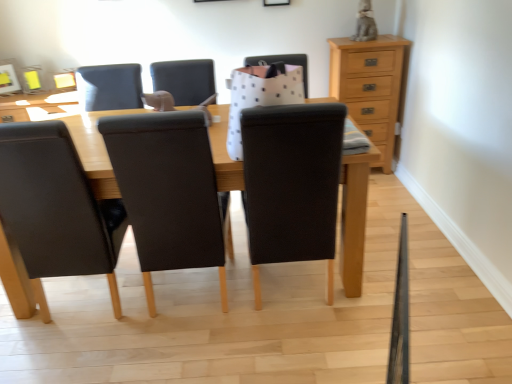
Measure the distance between point (200, 167) and camera.

Point (200, 167) is 1.71 meters away from camera.

Describe the element at coordinates (170, 193) in the screenshot. Image resolution: width=512 pixels, height=384 pixels. I see `leather at center, positioned as the 2th chair in right-to-left order` at that location.

Where is `black fabric chair at center, which ranks as the third chair in left-to-right order`? This screenshot has height=384, width=512. black fabric chair at center, which ranks as the third chair in left-to-right order is located at coordinates (291, 184).

From the picture: Can you see light brown wood chest of drawers at upper right touching leather at left, the 1th chair from the left?

No, light brown wood chest of drawers at upper right is not touching leather at left, the 1th chair from the left.

Could you tell me if light brown wood chest of drawers at upper right is facing leather at left, which is the 3th chair in right-to-left order?

No, light brown wood chest of drawers at upper right is not turned towards leather at left, which is the 3th chair in right-to-left order.

From a real-world perspective, is light brown wood chest of drawers at upper right under leather at left, the 1th chair from the left?

Yes, from a real-world perspective, light brown wood chest of drawers at upper right is below leather at left, the 1th chair from the left.

Considering the positions of objects light brown wood chest of drawers at upper right and leather at left, which is the 3th chair in right-to-left order, in the image provided, who is in front, light brown wood chest of drawers at upper right or leather at left, which is the 3th chair in right-to-left order,?

leather at left, which is the 3th chair in right-to-left order, is in front.

Does leather at center, positioned as the 2th chair in right-to-left order, have a greater height compared to leather at left, the 1th chair from the left?

No, leather at center, positioned as the 2th chair in right-to-left order, is not taller than leather at left, the 1th chair from the left.

In the scene shown: Is leather at center, which appears as the second chair when viewed from the left, at the right side of leather at left, which is the 3th chair in right-to-left order?

Yes.

From the image's perspective, is leather at center, positioned as the 2th chair in right-to-left order, beneath black fabric chair at center, which ranks as the third chair in left-to-right order?

Correct, leather at center, positioned as the 2th chair in right-to-left order, appears lower than black fabric chair at center, which ranks as the third chair in left-to-right order, in the image.

From the picture: Is leather at center, positioned as the 2th chair in right-to-left order, at the left side of black fabric chair at center, which ranks as the third chair in left-to-right order?

Yes.

Considering the relative sizes of leather at center, which appears as the second chair when viewed from the left, and black fabric chair at center, which ranks as the third chair in left-to-right order, in the image provided, is leather at center, which appears as the second chair when viewed from the left, thinner than black fabric chair at center, which ranks as the third chair in left-to-right order,?

Correct, the width of leather at center, which appears as the second chair when viewed from the left, is less than that of black fabric chair at center, which ranks as the third chair in left-to-right order.

Is point (267, 123) in front of point (191, 223)?

That is True.

From the image's perspective, is black fabric chair at center, positioned as the first chair in right-to-left order, beneath leather at center, positioned as the 2th chair in right-to-left order?

No, from the image's perspective, black fabric chair at center, positioned as the first chair in right-to-left order, is not beneath leather at center, positioned as the 2th chair in right-to-left order.

Is black fabric chair at center, positioned as the first chair in right-to-left order, placed right next to leather at center, positioned as the 2th chair in right-to-left order?

No, black fabric chair at center, positioned as the first chair in right-to-left order, is not beside leather at center, positioned as the 2th chair in right-to-left order.

Identify the location of chair located above the leather at center, positioned as the 2th chair in right-to-left order (from a real-world perspective). (291, 184).

The height and width of the screenshot is (384, 512). Find the location of `the chest of drawers that is above the leather at center, positioned as the 2th chair in right-to-left order (from the image's perspective)`. the chest of drawers that is above the leather at center, positioned as the 2th chair in right-to-left order (from the image's perspective) is located at coordinates (370, 87).

In terms of size, does light brown wood chest of drawers at upper right appear bigger or smaller than leather at center, positioned as the 2th chair in right-to-left order?

In the image, light brown wood chest of drawers at upper right appears to be smaller than leather at center, positioned as the 2th chair in right-to-left order.

How many degrees apart are the facing directions of light brown wood chest of drawers at upper right and leather at center, which appears as the second chair when viewed from the left?

The facing directions of light brown wood chest of drawers at upper right and leather at center, which appears as the second chair when viewed from the left, are 179 degrees apart.

Would you say light brown wood chest of drawers at upper right is to the left or to the right of leather at center, which appears as the second chair when viewed from the left, in the picture?

light brown wood chest of drawers at upper right is to the right of leather at center, which appears as the second chair when viewed from the left.

Is leather at center, which appears as the second chair when viewed from the left, shorter than light brown wood chest of drawers at upper right?

No.

Is leather at center, which appears as the second chair when viewed from the left, beside light brown wood chest of drawers at upper right?

No, leather at center, which appears as the second chair when viewed from the left, is not making contact with light brown wood chest of drawers at upper right.

In the image, is leather at center, which appears as the second chair when viewed from the left, on the left side or the right side of light brown wood chest of drawers at upper right?

Based on their positions, leather at center, which appears as the second chair when viewed from the left, is located to the left of light brown wood chest of drawers at upper right.

Is leather at left, which is the 3th chair in right-to-left order, oriented away from light brown wood chest of drawers at upper right?

That's not correct — leather at left, which is the 3th chair in right-to-left order, is not looking away from light brown wood chest of drawers at upper right.

Image resolution: width=512 pixels, height=384 pixels. What are the coordinates of `the chest of drawers located above the leather at left, which is the 3th chair in right-to-left order (from the image's perspective)` in the screenshot? It's located at (370, 87).

From the picture: From the image's perspective, which one is positioned lower, leather at left, the 1th chair from the left, or light brown wood chest of drawers at upper right?

leather at left, the 1th chair from the left, from the image's perspective.

In order to click on chest of drawers above the leather at left, which is the 3th chair in right-to-left order (from the image's perspective) in this screenshot , I will do `click(370, 87)`.

Where is `the 1st chair to the right of the leather at left, the 1th chair from the left, counting from the anchor's position`? the 1st chair to the right of the leather at left, the 1th chair from the left, counting from the anchor's position is located at coordinates (170, 193).

Based on their spatial positions, is leather at center, which appears as the second chair when viewed from the left, or light brown wood chest of drawers at upper right closer to black fabric chair at center, which ranks as the third chair in left-to-right order?

Among the two, leather at center, which appears as the second chair when viewed from the left, is located nearer to black fabric chair at center, which ranks as the third chair in left-to-right order.

Looking at the image, which one is located closer to leather at left, which is the 3th chair in right-to-left order, leather at center, which appears as the second chair when viewed from the left, or light brown wood chest of drawers at upper right?

Among the two, leather at center, which appears as the second chair when viewed from the left, is located nearer to leather at left, which is the 3th chair in right-to-left order.

From the image, which object appears to be nearer to leather at center, which appears as the second chair when viewed from the left, leather at left, which is the 3th chair in right-to-left order, or light brown wood chest of drawers at upper right?

leather at left, which is the 3th chair in right-to-left order, is closer to leather at center, which appears as the second chair when viewed from the left.

Looking at this image, estimate the real-world distances between objects in this image. Which object is closer to light brown wood chest of drawers at upper right, leather at center, positioned as the 2th chair in right-to-left order, or black fabric chair at center, positioned as the first chair in right-to-left order?

Based on the image, black fabric chair at center, positioned as the first chair in right-to-left order, appears to be nearer to light brown wood chest of drawers at upper right.

From the picture: From the image, which object appears to be farther from light brown wood chest of drawers at upper right, black fabric chair at center, which ranks as the third chair in left-to-right order, or leather at left, the 1th chair from the left?

leather at left, the 1th chair from the left, is positioned further to the anchor light brown wood chest of drawers at upper right.

Estimate the real-world distances between objects in this image. Which object is closer to leather at center, which appears as the second chair when viewed from the left, black fabric chair at center, positioned as the first chair in right-to-left order, or leather at left, the 1th chair from the left?

The object closer to leather at center, which appears as the second chair when viewed from the left, is leather at left, the 1th chair from the left.

Estimate the real-world distances between objects in this image. Which object is further from light brown wood chest of drawers at upper right, black fabric chair at center, positioned as the first chair in right-to-left order, or leather at center, positioned as the 2th chair in right-to-left order?

leather at center, positioned as the 2th chair in right-to-left order, lies further to light brown wood chest of drawers at upper right than the other object.

Based on their spatial positions, is leather at center, which appears as the second chair when viewed from the left, or black fabric chair at center, positioned as the first chair in right-to-left order, closer to leather at left, which is the 3th chair in right-to-left order?

The object closer to leather at left, which is the 3th chair in right-to-left order, is leather at center, which appears as the second chair when viewed from the left.

Locate an element on the screen. The width and height of the screenshot is (512, 384). chair between leather at left, which is the 3th chair in right-to-left order, and black fabric chair at center, positioned as the first chair in right-to-left order, in the horizontal direction is located at coordinates (170, 193).